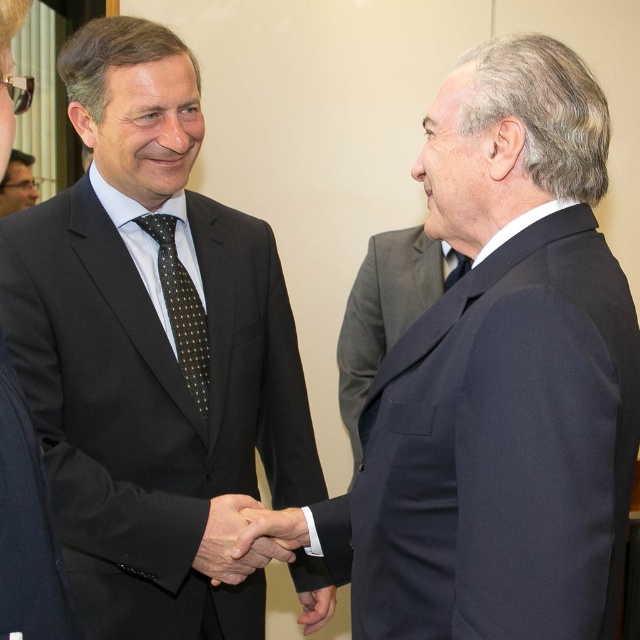
You are a photographer standing 10 feet away from the scene. You want to take a photo that includes both the smooth skin handshake at center and the matte black suit at upper left. Can you fit both into your camera frame if your camera has a 5.69 feet field of view?

The smooth skin handshake at center and the matte black suit at upper left are 5.69 feet apart from each other. Since your camera has a 5.69 feet field of view, you can fit both into your camera frame.

You are a fashion designer observing two suits in the image. The dark gray wool suit at center and the matte black suit at upper left. Which one is bigger in size?

The dark gray wool suit at center has a larger size compared to the matte black suit at upper left.

You are standing in a professional setting and see the navy wool suit at right. If you want to approach the person wearing it without moving too close, what is the minimum distance you should maintain?

The minimum distance you should maintain is approximately 30.82 inches, as that is the current distance between you and the navy wool suit at right.